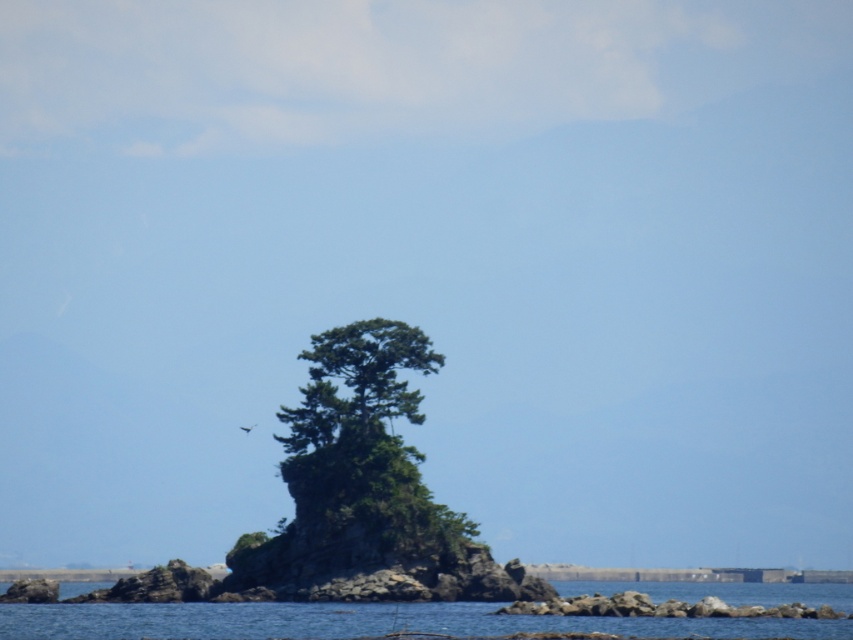
You are a bird flying over the coastal scene. You want to land on the green leafy tree at center. Can you safely land there without touching the blue water at center?

The green leafy tree at center is thinner than the blue water at center, so the tree may not provide enough space for a safe landing. Consider looking for a wider area or another tree to land on.

You are a photographer positioned at the edge of the coast facing the rocky island. You notice two points marked on your camera screen at coordinates point (430, 348) and point (219, 621). Which point is closer to your camera lens?

Point (219, 621) is closer to the camera lens because the description states that point (430, 348) is further to the camera than point (219, 621).